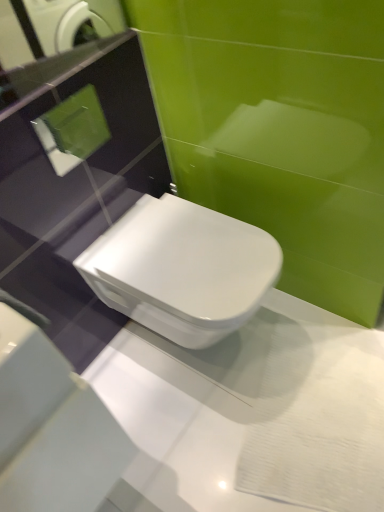
Image resolution: width=384 pixels, height=512 pixels. Identify the location of vacant space underneath white glossy toilet at center (from a real-world perspective). (220, 352).